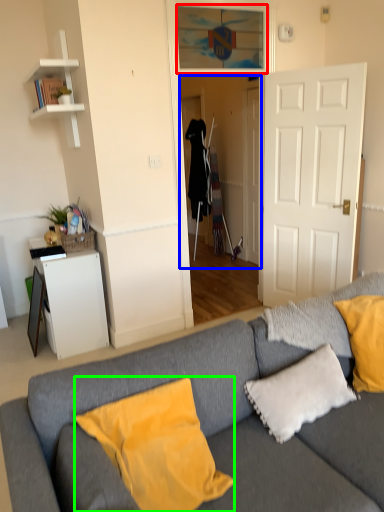
Question: Which object is positioned farthest from window (highlighted by a red box)? Select from glass door (highlighted by a blue box) and pillow (highlighted by a green box).

Choices:
 (A) glass door
 (B) pillow

Answer: (B)